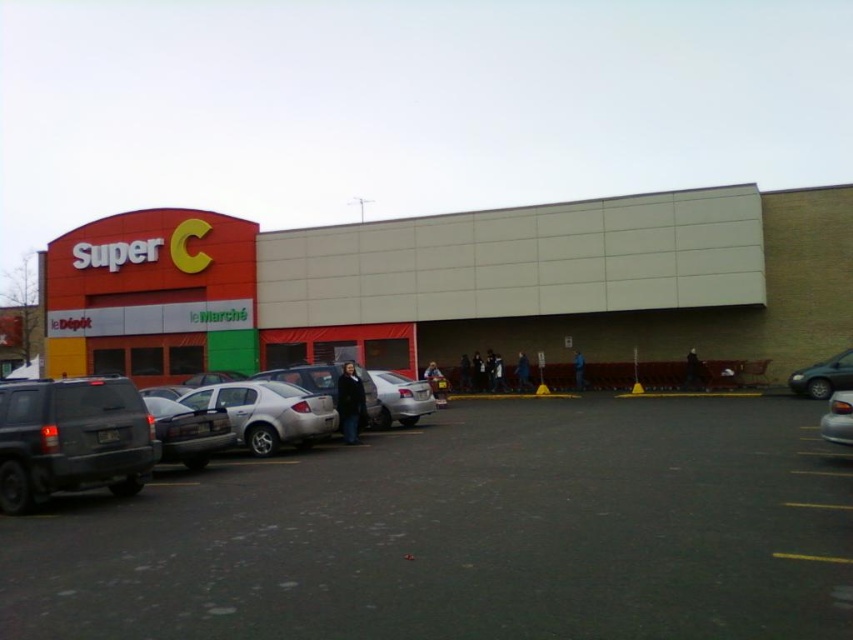
Looking at this image, can you confirm if red brick building at center is positioned below yellow matte line at lower center?

No, red brick building at center is not below yellow matte line at lower center.

Between red brick building at center and yellow matte line at lower center, which one appears on the right side from the viewer's perspective?

From the viewer's perspective, yellow matte line at lower center appears more on the right side.

Measure the distance between point (123, 324) and camera.

Point (123, 324) is 38.86 meters from camera.

You are a GUI agent. You are given a task and a screenshot of the screen. Output one action in this format:
    pyautogui.click(x=<x>, y=<y>)
    Task: Click on the red brick building at center
    
    Given the screenshot: What is the action you would take?
    pyautogui.click(x=463, y=284)

Who is positioned more to the right, metallic silver sedan at right or dark gray jacket at center?

From the viewer's perspective, metallic silver sedan at right appears more on the right side.

This screenshot has width=853, height=640. What do you see at coordinates (822, 376) in the screenshot? I see `metallic silver sedan at right` at bounding box center [822, 376].

Is point (807, 394) in front of point (346, 378)?

No, it is behind (346, 378).

Identify the location of metallic silver sedan at right. (822, 376).

Locate an element on the screen. matte black suv at lower left is located at coordinates (126, 429).

In the scene shown: Can you confirm if matte black suv at lower left is positioned to the left of dark gray matte suv at lower left?

Indeed, matte black suv at lower left is positioned on the left side of dark gray matte suv at lower left.

Identify the location of matte black suv at lower left. (126, 429).